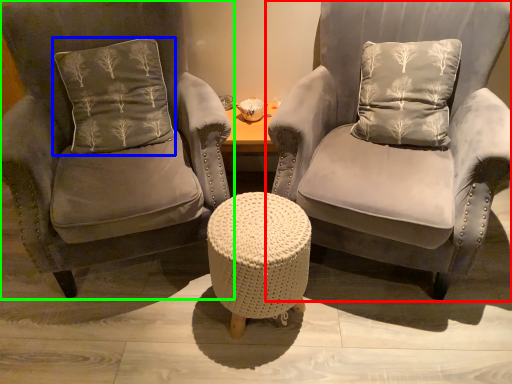
Question: Estimate the real-world distances between objects in this image. Which object is closer to chair (highlighted by a red box), pillow (highlighted by a blue box) or chair (highlighted by a green box)?

Choices:
 (A) pillow
 (B) chair

Answer: (B)